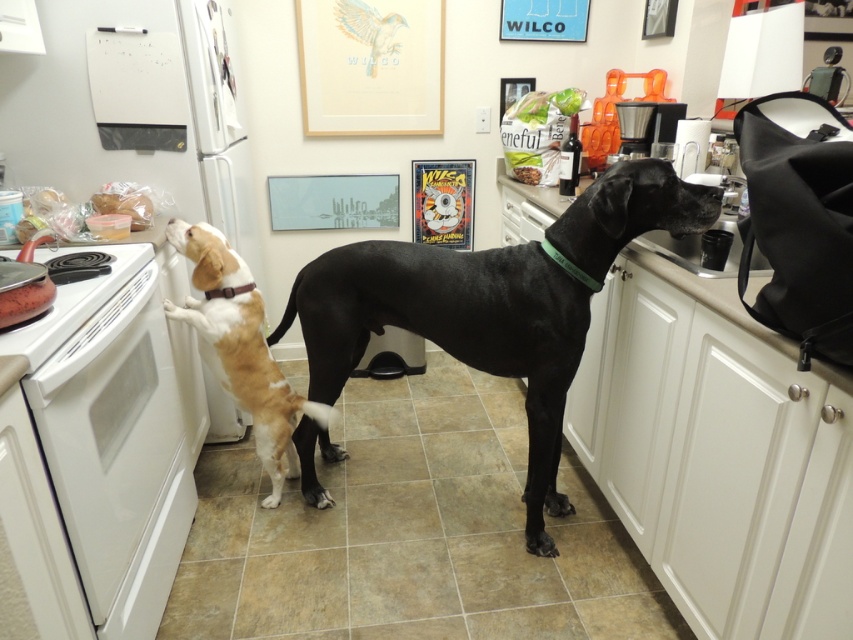
You are a dog trainer observing the two dogs in the kitchen. The black smooth coat dog at center and the light brown fur at left are both trying to reach a treat placed on the counter. Considering their sizes, which dog might have an easier time reaching the treat?

The black smooth coat dog at center has a larger width than the light brown fur at left, so it might have an easier time reaching the treat due to its bigger size.

Looking at this image, you are a chef in this kitchen and need to reach the black plastic coffee maker at upper right. Which direction should you move relative to the black smooth coat dog at center to get there?

The black smooth coat dog at center is located below the black plastic coffee maker at upper right, so you should move upward from the dog to reach the coffee maker.